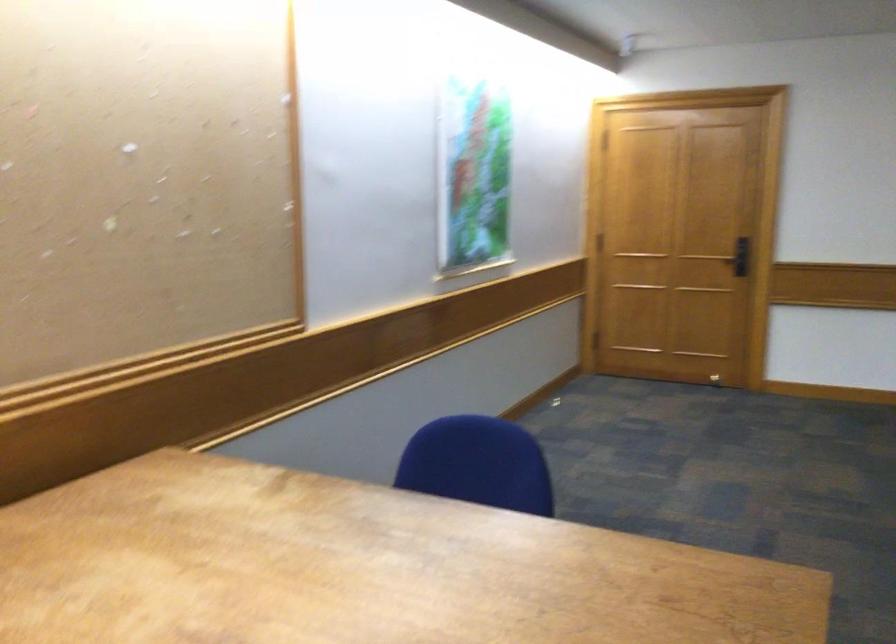
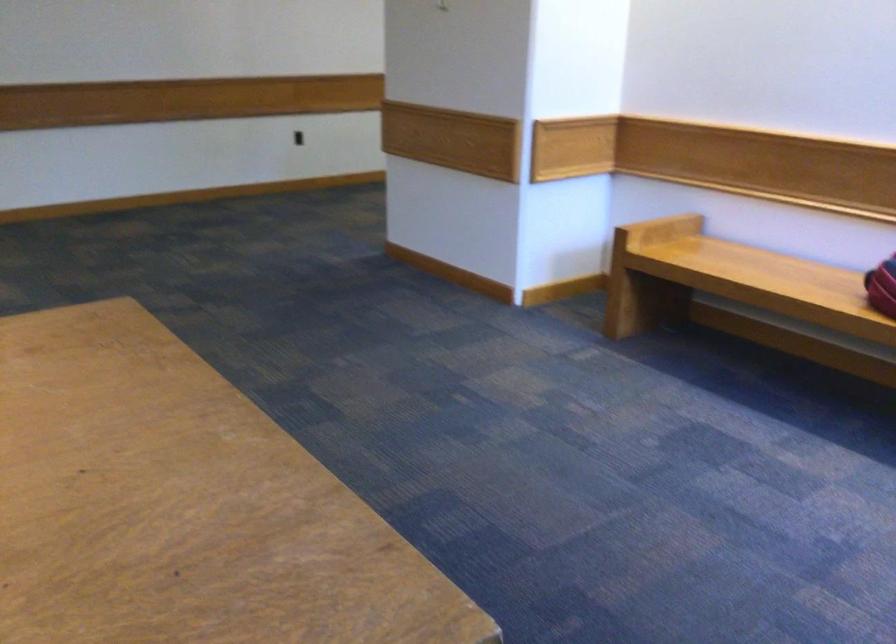
Question: The camera is either moving clockwise (left) or counter-clockwise (right) around the object. The first image is from the beginning of the video and the second image is from the end. Is the camera moving left or right when shooting the video?

Choices:
 (A) Left
 (B) Right

Answer: (A)